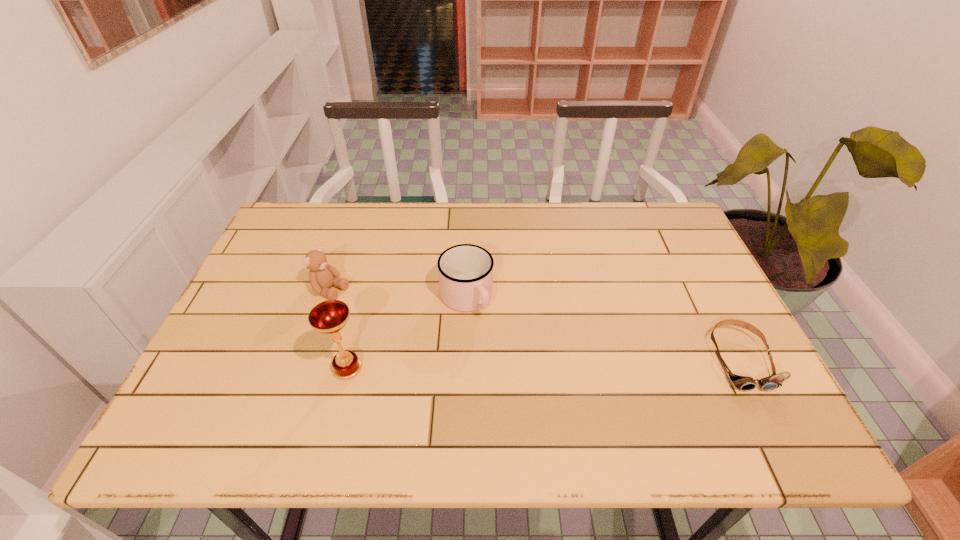
The width and height of the screenshot is (960, 540). I want to click on chalice, so click(329, 317).

Find the location of a particular element. the third object from right to left is located at coordinates (329, 317).

Identify the location of the shortest object. This screenshot has height=540, width=960. (744, 383).

Find the location of a particular element. This screenshot has height=540, width=960. the rightmost object is located at coordinates (744, 383).

Find the location of a particular element. This screenshot has height=540, width=960. the leftmost object is located at coordinates (322, 276).

Find the location of a particular element. The width and height of the screenshot is (960, 540). mug is located at coordinates click(465, 271).

Locate an element on the screen. The image size is (960, 540). blank area located on the back of the third object from right to left is located at coordinates (369, 287).

This screenshot has width=960, height=540. I want to click on free space located 0.150m on the front-facing side of the leftmost object, so click(x=390, y=318).

At what (x,y) coordinates should I click in order to perform the action: click on vacant position located on the front-facing side of the leftmost object. Please return your answer as a coordinate pair (x, y). This screenshot has width=960, height=540. Looking at the image, I should click on (440, 342).

Locate an element on the screen. The image size is (960, 540). vacant region located on the front-facing side of the leftmost object is located at coordinates (458, 350).